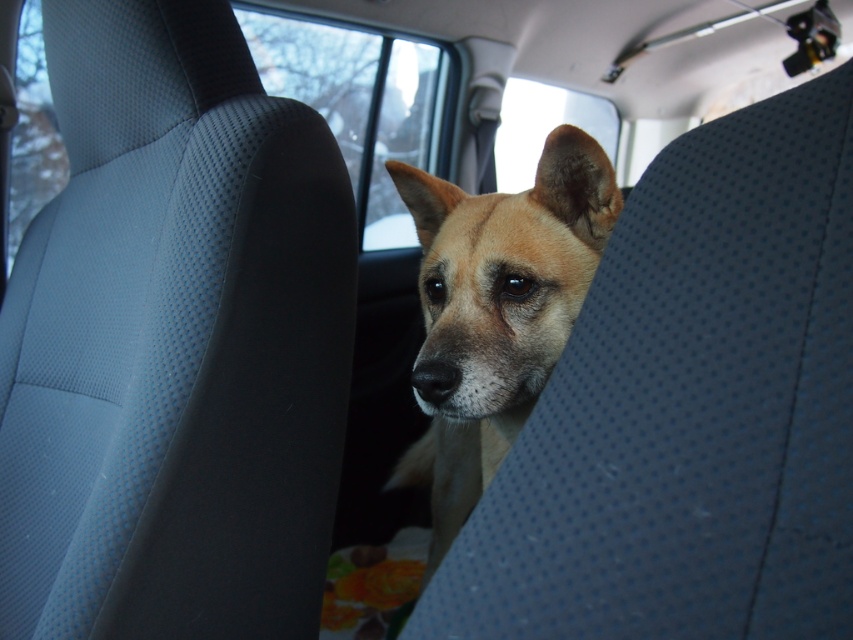
Is light brown fur dog at center in front of transparent glass window at upper center?

Yes, light brown fur dog at center is in front of transparent glass window at upper center.

Between light brown fur dog at center and transparent glass window at upper center, which one is positioned higher?

transparent glass window at upper center

Which is in front, point (564, 296) or point (302, 83)?

Point (564, 296)

Locate an element on the screen. Image resolution: width=853 pixels, height=640 pixels. light brown fur dog at center is located at coordinates (495, 310).